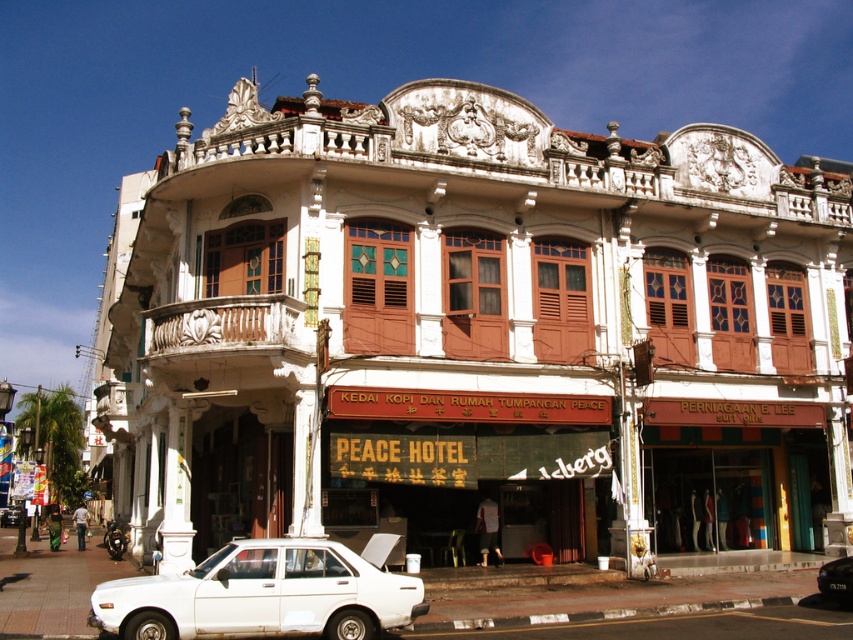
Is point (231, 452) farther from viewer compared to point (315, 540)?

Yes, point (231, 452) is behind point (315, 540).

Image resolution: width=853 pixels, height=640 pixels. Identify the location of white textured building at center. (480, 333).

Does white matte car at lower center have a greater height compared to white matte car at center?

In fact, white matte car at lower center may be shorter than white matte car at center.

Is point (181, 605) positioned behind point (20, 513)?

That is False.

Is point (267, 544) closer to camera compared to point (9, 506)?

Yes, it is.

Find the location of a particular element. Image resolution: width=853 pixels, height=640 pixels. white matte car at lower center is located at coordinates (260, 595).

Between white matte car at lower center and white matte sedan at center, which one has more height?

white matte sedan at center

Describe the element at coordinates (260, 595) in the screenshot. This screenshot has height=640, width=853. I see `white matte car at lower center` at that location.

Does point (285, 611) come behind point (844, 563)?

That is False.

The height and width of the screenshot is (640, 853). Identify the location of white matte car at lower center. (x=260, y=595).